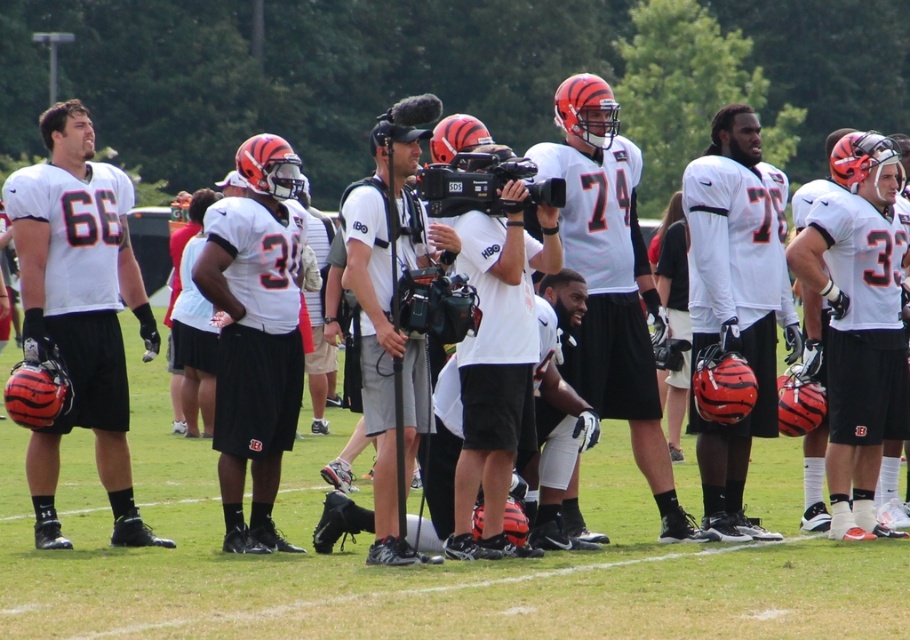
Question: Which point is farther from the camera taking this photo?

Choices:
 (A) (598, 88)
 (B) (696, 451)
 (C) (355, 304)

Answer: (C)

Question: Can you confirm if white matte jersey at center is smaller than white matte helmet at center?

Choices:
 (A) no
 (B) yes

Answer: (A)

Question: Which object appears farthest from the camera in this image?

Choices:
 (A) white matte jersey at center
 (B) matte white jersey at left
 (C) white matte camera at center

Answer: (A)

Question: Can you confirm if white matte jersey at center is thinner than white matte camera at center?

Choices:
 (A) yes
 (B) no

Answer: (B)

Question: Does matte white jersey at left have a lesser width compared to white matte jersey at center?

Choices:
 (A) yes
 (B) no

Answer: (B)

Question: Among these points, which one is farthest from the camera?

Choices:
 (A) (504, 538)
 (B) (380, 385)
 (C) (602, 205)
 (D) (686, 172)

Answer: (C)